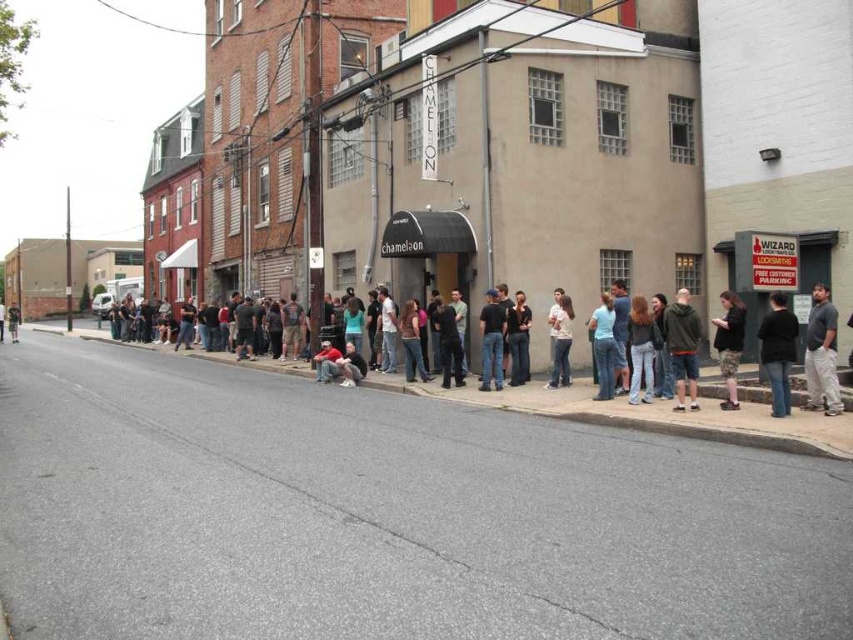
You are a photographer trying to capture a photo of the crowd at the Chameleon building. You notice two people in the crowd wearing a dark gray shirt at lower right and light blue denim jeans at center. Which person should you focus on to ensure their clothing is fully visible in the frame?

The dark gray shirt at lower right has a greater width than the light blue denim jeans at center, so focusing on the dark gray shirt at lower right will ensure the clothing is fully visible as it is wider.

You are a photographer trying to capture a clear shot of the light blue denim jeans at center without the camouflage pants at center blocking it. Based on the scene description, can you determine if this is possible?

The light blue denim jeans at center is positioned under camouflage pants at center, so it is partially or completely hidden by the camouflage pants at center. Therefore, capturing a clear shot of the light blue denim jeans at center without obstruction might not be possible unless the photographer adjusts their angle or the subjects move.